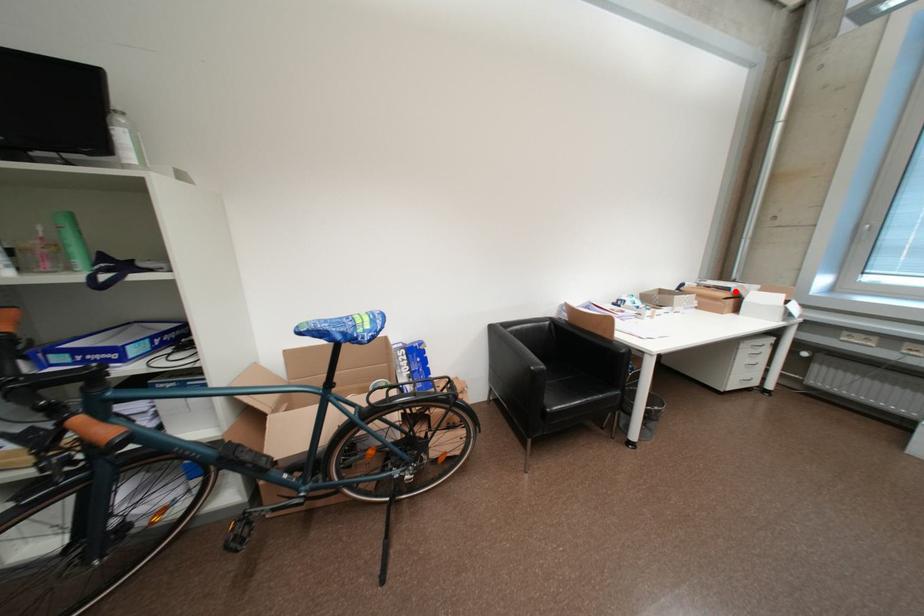
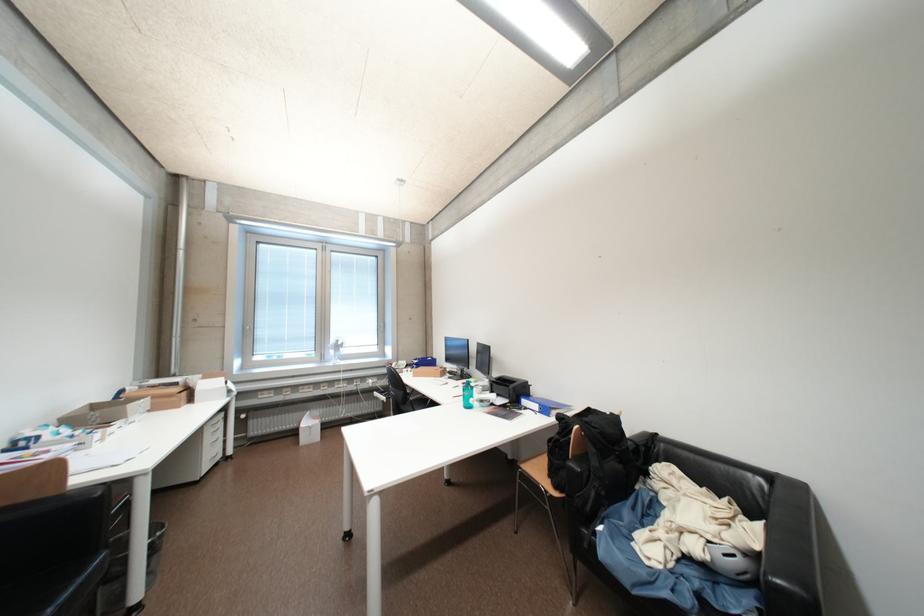
In the second image, find the point that corresponds to the highlighted location in the first image.

(184, 386)